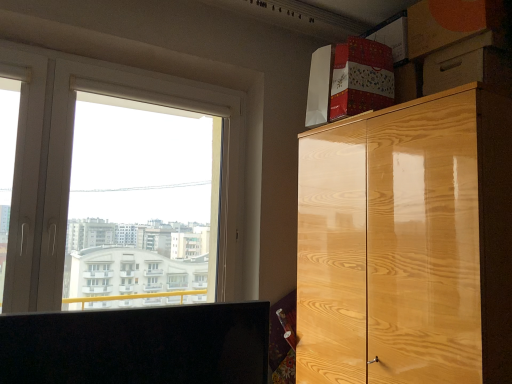
Where is `glossy wood cabinet at upper right`? glossy wood cabinet at upper right is located at coordinates pos(407,244).

Locate an element on the screen. The width and height of the screenshot is (512, 384). orange cardboard box at upper right is located at coordinates (449, 22).

Is white plastic window at upper left placed right next to glossy wood cabinet at upper right?

No, white plastic window at upper left is not touching glossy wood cabinet at upper right.

Measure the distance from white plastic window at upper left to glossy wood cabinet at upper right.

A distance of 34.74 inches exists between white plastic window at upper left and glossy wood cabinet at upper right.

Between white plastic window at upper left and glossy wood cabinet at upper right, which one has smaller width?

white plastic window at upper left is thinner.

From a real-world perspective, which object stands above the other?

orange cardboard box at upper right.

Is glossy wood cabinet at upper right in contact with orange cardboard box at upper right?

There is a gap between glossy wood cabinet at upper right and orange cardboard box at upper right.

Would you say glossy wood cabinet at upper right is outside orange cardboard box at upper right?

glossy wood cabinet at upper right lies outside orange cardboard box at upper right's area.

Can you see orange cardboard box at upper right touching glossy wood cabinet at upper right?

They are not placed beside each other.

In the image, is orange cardboard box at upper right on the left side or the right side of glossy wood cabinet at upper right?

In the image, orange cardboard box at upper right appears on the right side of glossy wood cabinet at upper right.

Considering the sizes of objects orange cardboard box at upper right and glossy wood cabinet at upper right in the image provided, who is bigger, orange cardboard box at upper right or glossy wood cabinet at upper right?

glossy wood cabinet at upper right.

Considering the relative positions of orange cardboard box at upper right and glossy wood cabinet at upper right in the image provided, is orange cardboard box at upper right in front of glossy wood cabinet at upper right?

No, orange cardboard box at upper right is behind glossy wood cabinet at upper right.

Looking at this image, considering the sizes of objects white plastic window at upper left and orange cardboard box at upper right in the image provided, who is wider, white plastic window at upper left or orange cardboard box at upper right?

orange cardboard box at upper right is wider.

Considering the relative sizes of white plastic window at upper left and orange cardboard box at upper right in the image provided, is white plastic window at upper left shorter than orange cardboard box at upper right?

No, white plastic window at upper left is not shorter than orange cardboard box at upper right.

At what (x,y) coordinates should I click in order to perform the action: click on window behind the orange cardboard box at upper right. Please return your answer as a coordinate pair (x, y). Looking at the image, I should click on (71, 162).

From a real-world perspective, is orange cardboard box at upper right above or below white plastic window at upper left?

From a real-world perspective, orange cardboard box at upper right is physically above white plastic window at upper left.

Is orange cardboard box at upper right aimed at white plastic window at upper left?

No, orange cardboard box at upper right is not facing towards white plastic window at upper left.

Does orange cardboard box at upper right have a greater height compared to white plastic window at upper left?

In fact, orange cardboard box at upper right may be shorter than white plastic window at upper left.

Can you see glossy wood cabinet at upper right touching white plastic window at upper left?

There is a gap between glossy wood cabinet at upper right and white plastic window at upper left.

Considering the relative positions of glossy wood cabinet at upper right and white plastic window at upper left in the image provided, is glossy wood cabinet at upper right to the right of white plastic window at upper left from the viewer's perspective?

Yes, glossy wood cabinet at upper right is to the right of white plastic window at upper left.

The height and width of the screenshot is (384, 512). Find the location of `cabinetry in front of the white plastic window at upper left`. cabinetry in front of the white plastic window at upper left is located at coordinates (407, 244).

Locate an element on the screen. Image resolution: width=512 pixels, height=384 pixels. cabinetry in front of the white plastic window at upper left is located at coordinates (407, 244).

Identify the location of cardboard box positioned vertically above the glossy wood cabinet at upper right (from a real-world perspective). The width and height of the screenshot is (512, 384). (449, 22).

Looking at the image, which one is located further to white plastic window at upper left, glossy wood cabinet at upper right or orange cardboard box at upper right?

Among the two, orange cardboard box at upper right is located further to white plastic window at upper left.

Looking at the image, which one is located further to glossy wood cabinet at upper right, white plastic window at upper left or orange cardboard box at upper right?

white plastic window at upper left is further to glossy wood cabinet at upper right.

Looking at the image, which one is located closer to white plastic window at upper left, orange cardboard box at upper right or glossy wood cabinet at upper right?

The object closer to white plastic window at upper left is glossy wood cabinet at upper right.

From the image, which object appears to be nearer to orange cardboard box at upper right, white plastic window at upper left or glossy wood cabinet at upper right?

glossy wood cabinet at upper right is closer to orange cardboard box at upper right.

Which object lies nearer to the anchor point glossy wood cabinet at upper right, orange cardboard box at upper right or white plastic window at upper left?

orange cardboard box at upper right is closer to glossy wood cabinet at upper right.

Considering their positions, is glossy wood cabinet at upper right positioned further to orange cardboard box at upper right than white plastic window at upper left?

white plastic window at upper left is positioned further to the anchor orange cardboard box at upper right.

Locate an element on the screen. The image size is (512, 384). cabinetry between white plastic window at upper left and orange cardboard box at upper right from left to right is located at coordinates (407, 244).